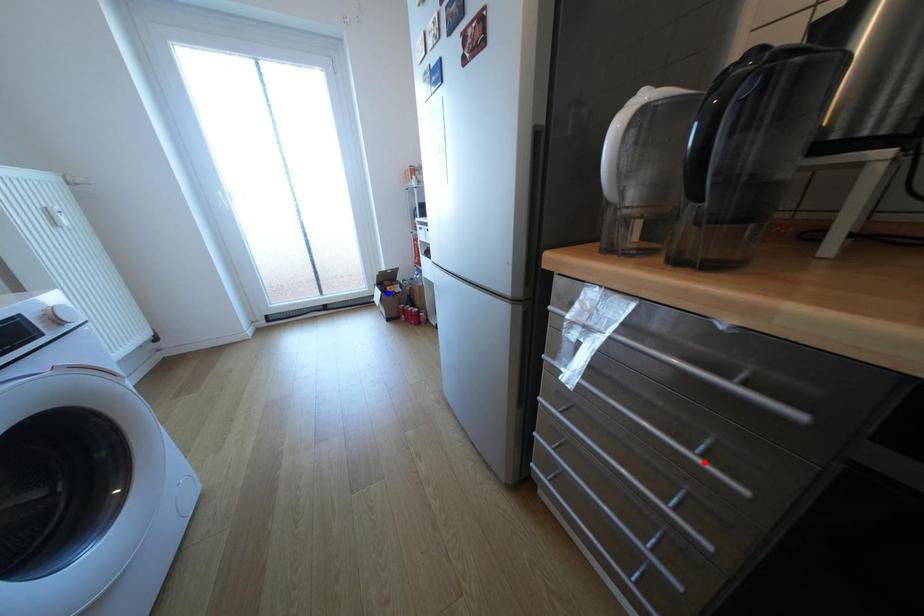
Question: In the image, two points are highlighted. Which point is nearer to the camera? Reply with the corresponding letter.

Choices:
 (A) blue point
 (B) red point

Answer: (B)